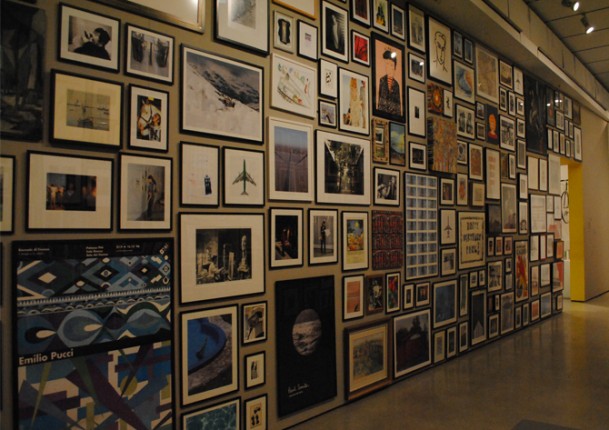
The height and width of the screenshot is (430, 609). Find the location of `floor`. floor is located at coordinates (564, 372).